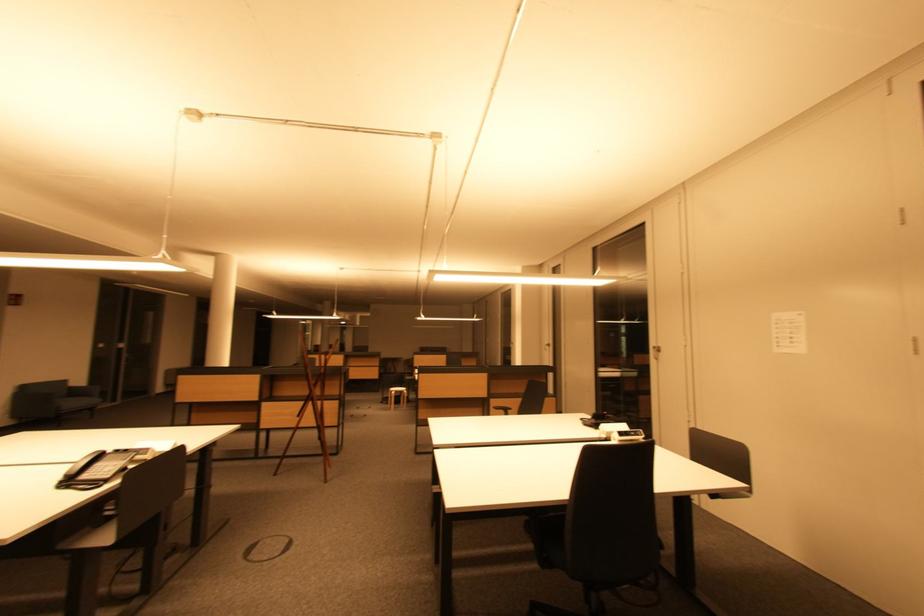
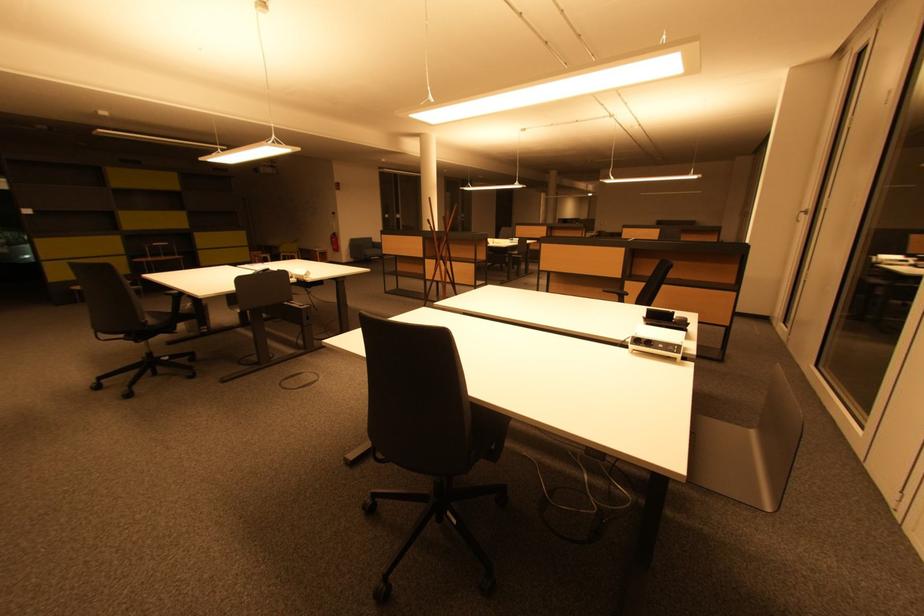
The point at (552, 346) is marked in the first image. Where is the corresponding point in the second image?

(808, 212)